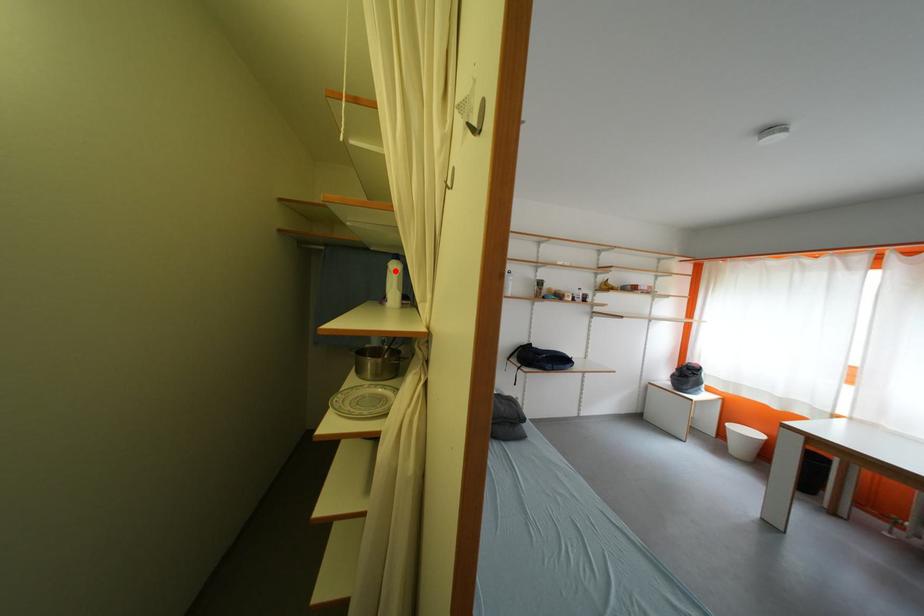
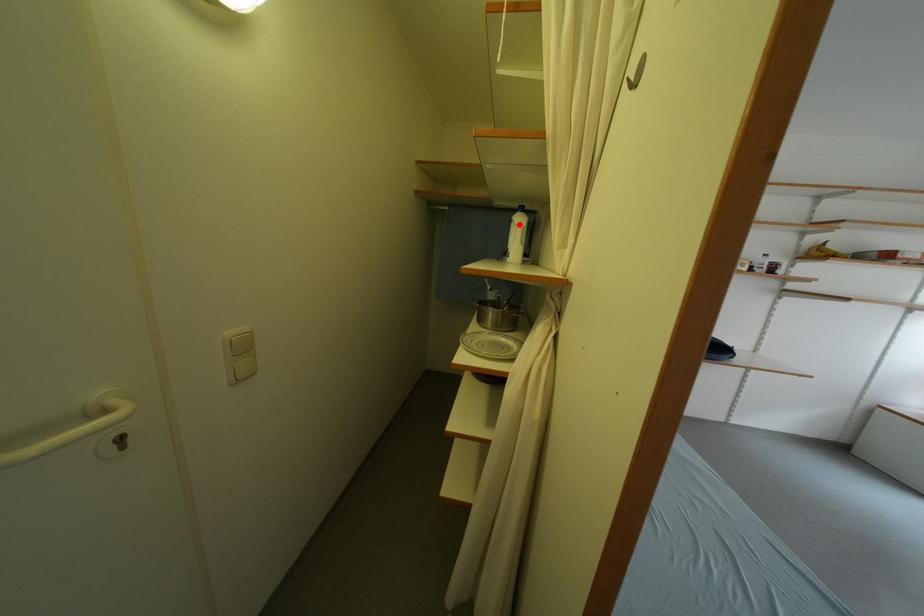
I am providing you with two images of the same scene from different viewpoints. A red point is marked on the first image and another point is marked on the second image. Do the highlighted points in image1 and image2 indicate the same real-world spot?

Yes